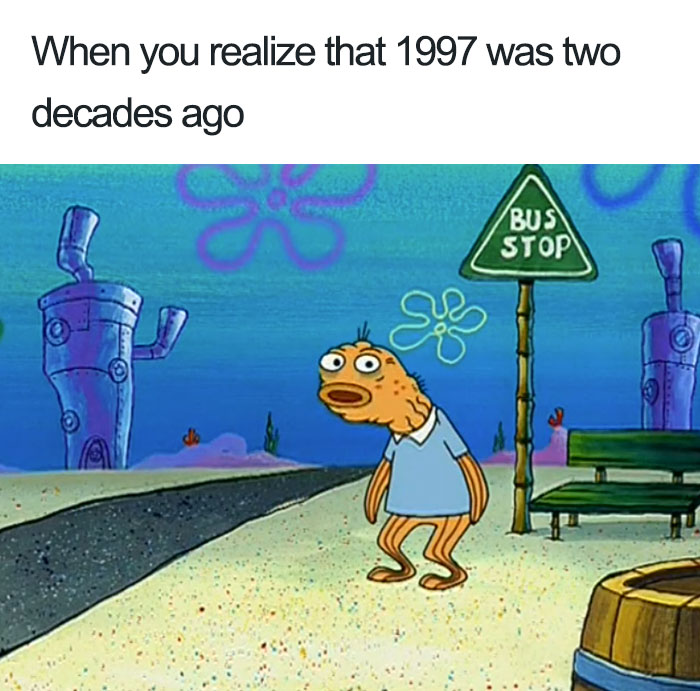
This screenshot has width=700, height=691. I want to click on window, so (680, 338), (56, 332).